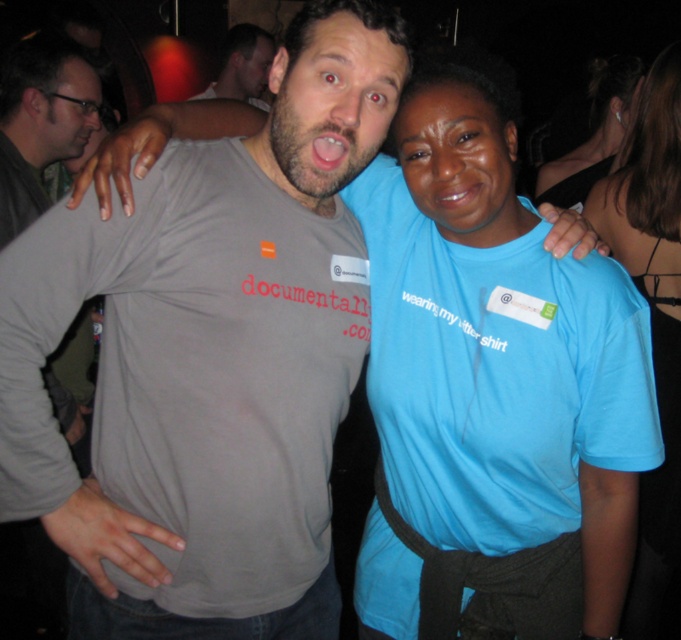
You are standing at the origin point of the image coordinate system. You want to move to the point labeled point (674, 529). Is this point closer to you than the other point labeled point (588, 145)?

Point (674, 529) is in front of point (588, 145), so yes, it is closer to you than the other point.